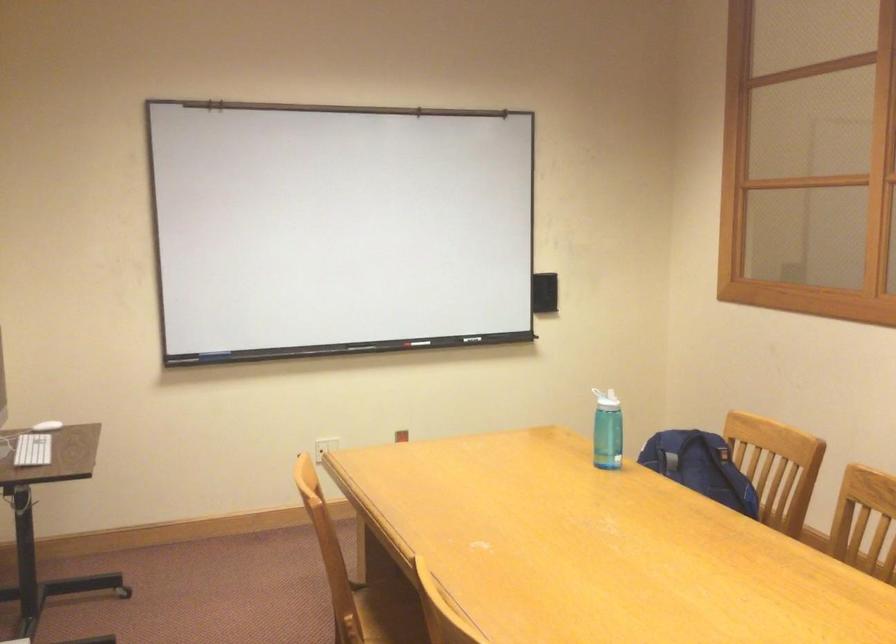
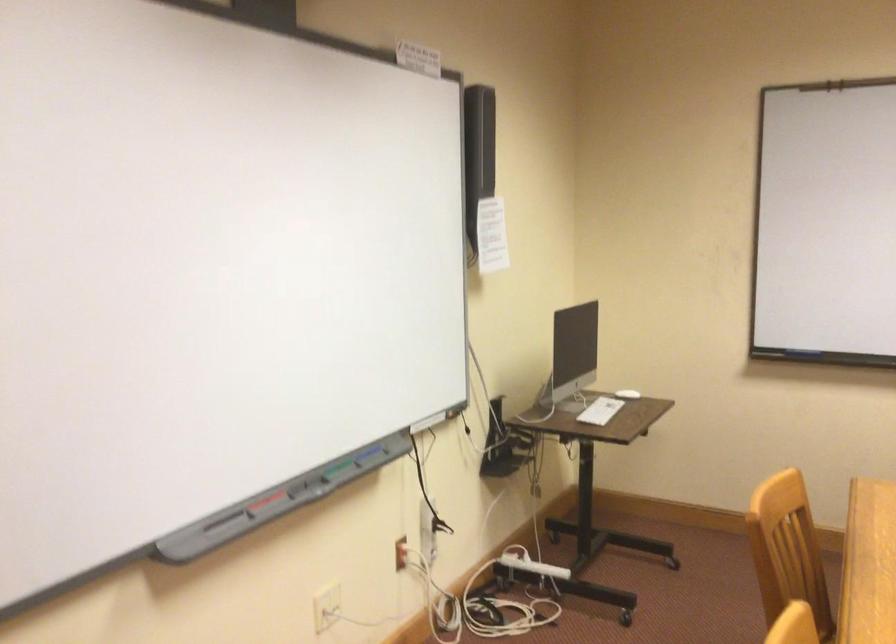
Question: How did the camera likely rotate?

Choices:
 (A) Left
 (B) Right
 (C) Up
 (D) Down

Answer: (A)